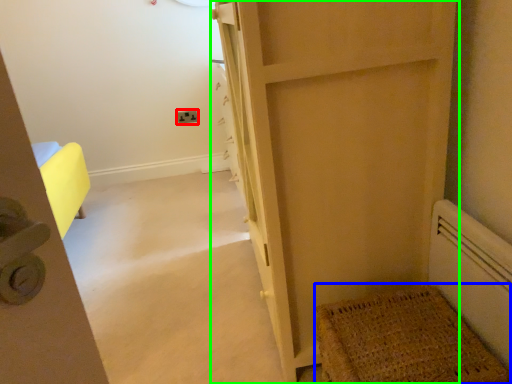
Question: Based on their relative distances, which object is farther from electric outlet (highlighted by a red box)? Choose from doormat (highlighted by a blue box) and door (highlighted by a green box).

Choices:
 (A) doormat
 (B) door

Answer: (A)